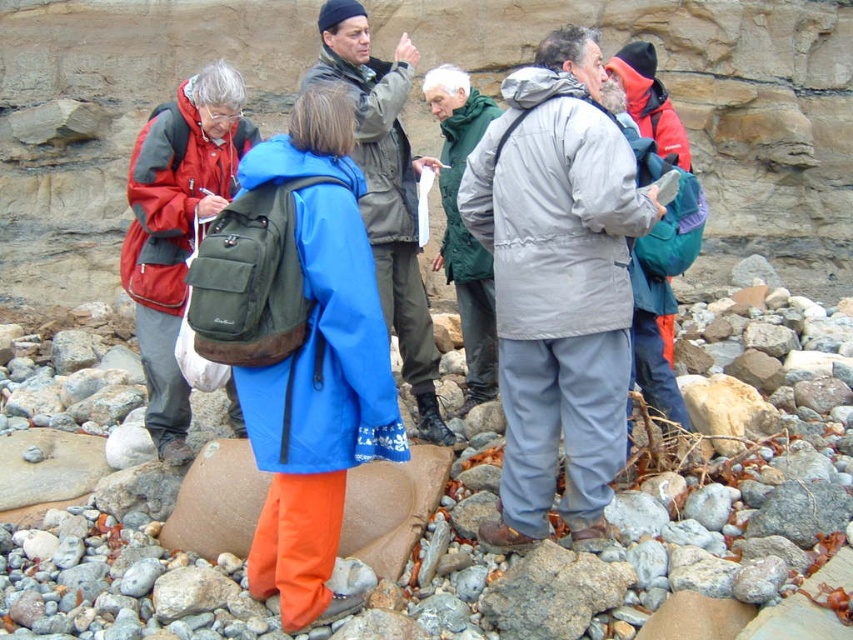
Question: Among these objects, which one is nearest to the camera?

Choices:
 (A) matte black backpack at left
 (B) gray matte jacket at center

Answer: (B)

Question: Observing the image, what is the correct spatial positioning of matte gray jacket at center in reference to green woolen scarf at center?

Choices:
 (A) right
 (B) left

Answer: (B)

Question: Estimate the real-world distances between objects in this image. Which object is closer to the matte green backpack at center?

Choices:
 (A) teal fabric backpack at center
 (B) matte gray jacket at center
 (C) gray matte jacket at center
 (D) matte black backpack at left

Answer: (B)

Question: Is matte gray jacket at center thinner than teal fabric backpack at center?

Choices:
 (A) no
 (B) yes

Answer: (A)

Question: Is matte green backpack at center thinner than gray matte jacket at center?

Choices:
 (A) no
 (B) yes

Answer: (A)

Question: Among these points, which one is nearest to the camera?

Choices:
 (A) (440, 106)
 (B) (157, 125)
 (C) (672, 340)
 (D) (367, 77)

Answer: (B)